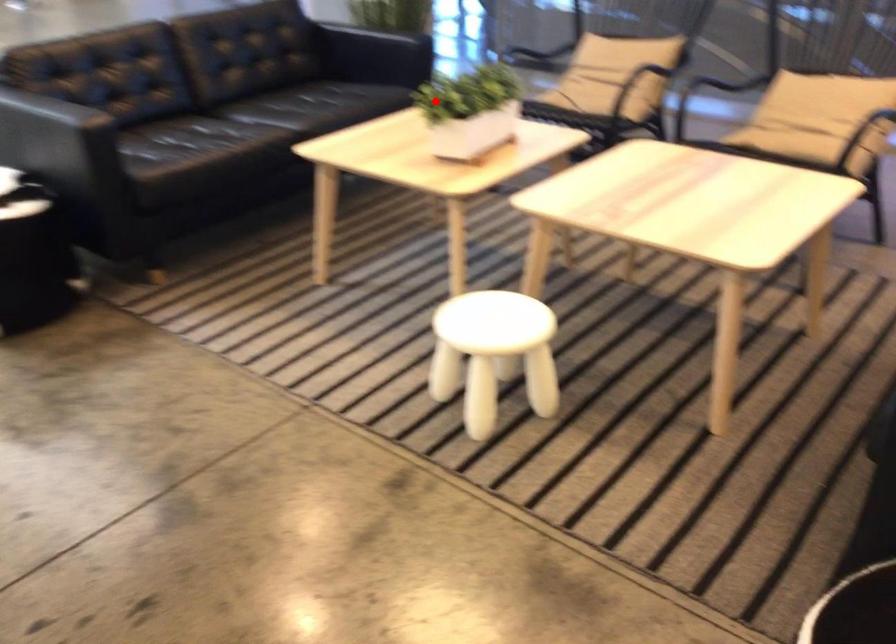
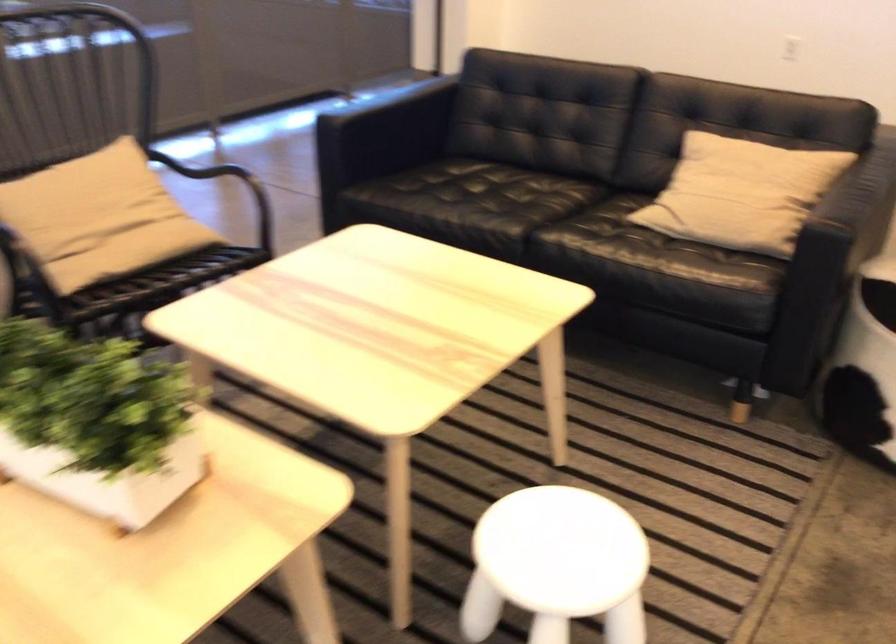
Locate, in the second image, the point that corresponds to the highlighted location in the first image.

(96, 422)